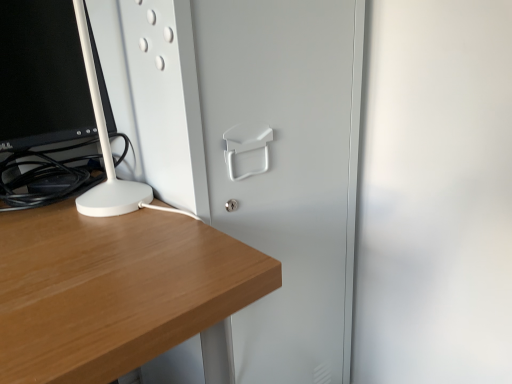
Question: Looking at the image, does black glossy computer monitor at left seem bigger or smaller compared to white matte glass door at center?

Choices:
 (A) big
 (B) small

Answer: (B)

Question: Which is correct: black glossy computer monitor at left is inside white matte glass door at center, or outside of it?

Choices:
 (A) inside
 (B) outside

Answer: (B)

Question: Looking at their shapes, would you say black glossy computer monitor at left is wider or thinner than white matte glass door at center?

Choices:
 (A) wide
 (B) thin

Answer: (B)

Question: In the image, is white matte glass door at center positioned in front of or behind black glossy computer monitor at left?

Choices:
 (A) behind
 (B) front

Answer: (B)

Question: Is white matte glass door at center taller or shorter than black glossy computer monitor at left?

Choices:
 (A) short
 (B) tall

Answer: (B)

Question: In the image, is white matte glass door at center on the left side or the right side of black glossy computer monitor at left?

Choices:
 (A) left
 (B) right

Answer: (B)

Question: From a real-world perspective, is white matte glass door at center positioned above or below black glossy computer monitor at left?

Choices:
 (A) below
 (B) above

Answer: (A)